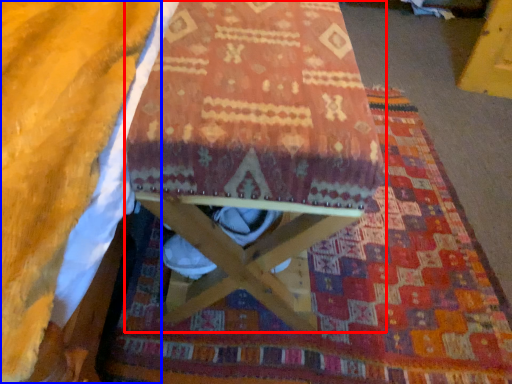
Question: Which point is further to the camera, furniture (highlighted by a red box) or blanket (highlighted by a blue box)?

Choices:
 (A) furniture
 (B) blanket

Answer: (A)